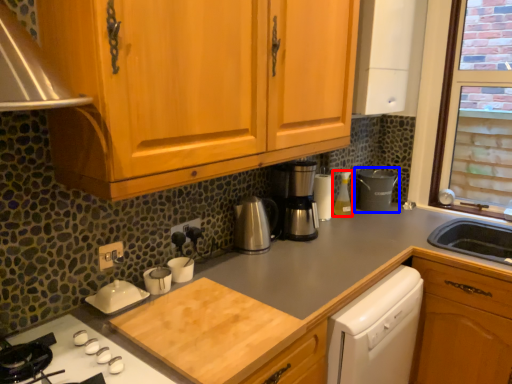
Question: Which object appears farthest to the camera in this image, bottle (highlighted by a red box) or appliance (highlighted by a blue box)?

Choices:
 (A) bottle
 (B) appliance

Answer: (B)